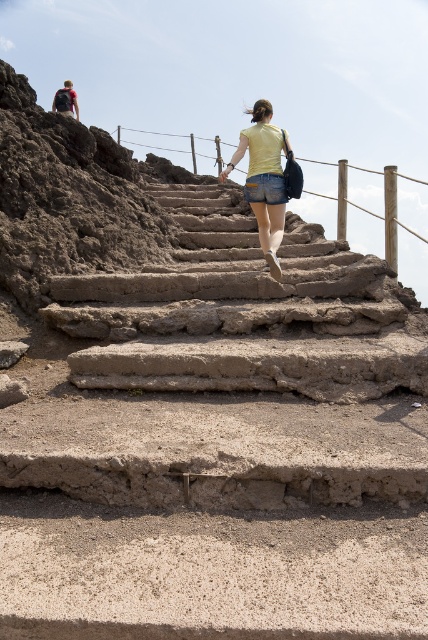
Question: Does rustic concrete stairs at center appear on the left side of brown dirt hill at upper left?

Choices:
 (A) yes
 (B) no

Answer: (B)

Question: Does brown dirt hill at upper left appear on the right side of red fabric backpack at upper left?

Choices:
 (A) no
 (B) yes

Answer: (B)

Question: Among these points, which one is nearest to the camera?

Choices:
 (A) (21, 234)
 (B) (237, 157)
 (C) (58, 99)
 (D) (270, 189)

Answer: (A)

Question: Can you confirm if rustic concrete stairs at center is bigger than denim shorts at center?

Choices:
 (A) no
 (B) yes

Answer: (B)

Question: Based on their relative distances, which object is farther from the yellow denim shorts at center?

Choices:
 (A) rustic concrete stairs at center
 (B) red fabric backpack at upper left
 (C) denim shorts at center

Answer: (B)

Question: Which object is the farthest from the red fabric backpack at upper left?

Choices:
 (A) rustic concrete stairs at center
 (B) denim shorts at center
 (C) yellow denim shorts at center
 (D) brown dirt hill at upper left

Answer: (A)